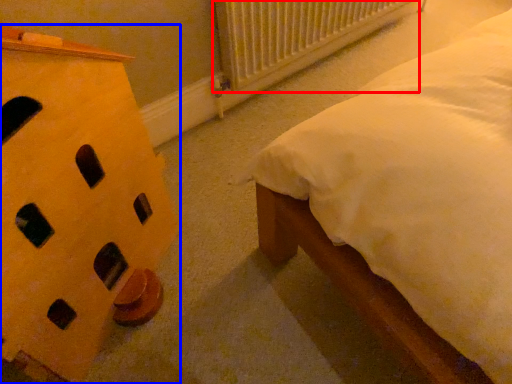
Question: Which object is closer to the camera taking this photo, radiator (highlighted by a red box) or furniture (highlighted by a blue box)?

Choices:
 (A) radiator
 (B) furniture

Answer: (B)